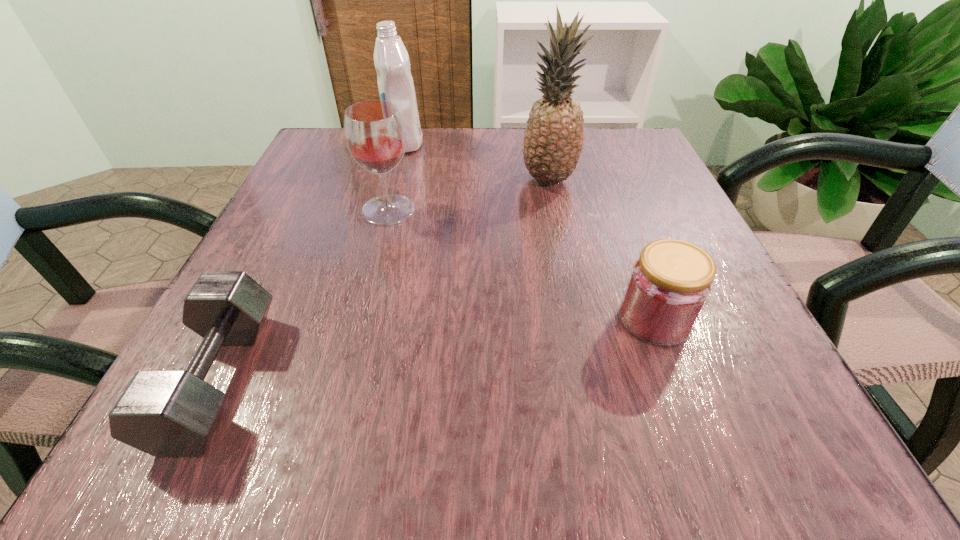
The image size is (960, 540). What are the coordinates of `dumbbell positioned at the left edge` in the screenshot? It's located at click(163, 413).

Locate an element on the screen. The width and height of the screenshot is (960, 540). object located in the right edge section of the desktop is located at coordinates (670, 283).

I want to click on object that is at the far left corner, so click(x=395, y=83).

Locate an element on the screen. This screenshot has width=960, height=540. object that is at the near left corner is located at coordinates (163, 413).

Locate an element on the screen. Image resolution: width=960 pixels, height=540 pixels. blank space at the far edge of the desktop is located at coordinates (426, 145).

This screenshot has width=960, height=540. Find the location of `free space at the left edge of the desktop`. free space at the left edge of the desktop is located at coordinates (327, 273).

Find the location of `free spot at the right edge of the desktop`. free spot at the right edge of the desktop is located at coordinates coord(622,222).

In the image, there is a desktop. Identify the location of vacant space at the far left corner. Image resolution: width=960 pixels, height=540 pixels. (346, 149).

You are a GUI agent. You are given a task and a screenshot of the screen. Output one action in this format:
    pyautogui.click(x=<x>, y=<y>)
    Task: Click on the free space between the dumbbell and the third shortest object
    This screenshot has width=960, height=540.
    Given the screenshot: What is the action you would take?
    coord(303,294)

Locate an element on the screen. unoccupied position between the second tallest object and the jam is located at coordinates (530, 231).